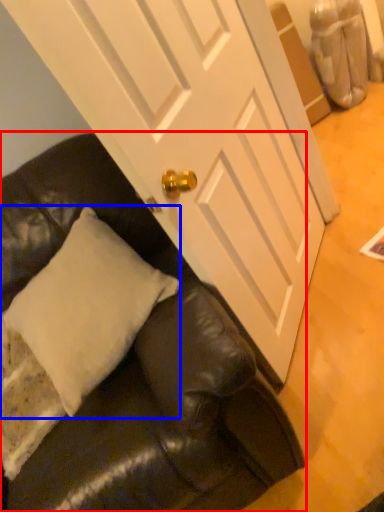
Question: Which object appears closest to the camera in this image, studio couch (highlighted by a red box) or pillow (highlighted by a blue box)?

Choices:
 (A) studio couch
 (B) pillow

Answer: (A)